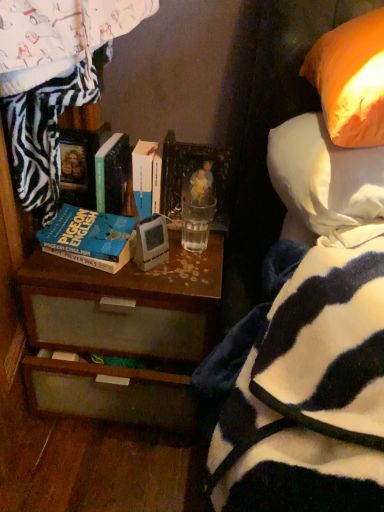
Question: From a real-world perspective, is blue matte book at center left, which appears as the 1th book when viewed from the left, positioned over orange fabric pillow at upper right based on gravity?

Choices:
 (A) yes
 (B) no

Answer: (B)

Question: Are blue matte book at center left, the 3th book viewed from the right, and orange fabric pillow at upper right far apart?

Choices:
 (A) no
 (B) yes

Answer: (A)

Question: Is blue matte book at center left, the 3th book viewed from the right, shorter than orange fabric pillow at upper right?

Choices:
 (A) yes
 (B) no

Answer: (A)

Question: Can you confirm if blue matte book at center left, the 3th book viewed from the right, is positioned to the right of orange fabric pillow at upper right?

Choices:
 (A) no
 (B) yes

Answer: (A)

Question: From the image's perspective, is blue matte book at center left, the 3th book viewed from the right, over orange fabric pillow at upper right?

Choices:
 (A) no
 (B) yes

Answer: (A)

Question: Is blue matte book at center left, which appears as the 1th book when viewed from the left, bigger than orange fabric pillow at upper right?

Choices:
 (A) no
 (B) yes

Answer: (A)

Question: Does brown wood desk at center have a lesser width compared to blue matte book at center left, which appears as the 1th book when viewed from the left?

Choices:
 (A) yes
 (B) no

Answer: (B)

Question: Would you say brown wood desk at center contains blue matte book at center left, which appears as the 1th book when viewed from the left?

Choices:
 (A) yes
 (B) no

Answer: (B)

Question: From the image's perspective, is brown wood desk at center on blue matte book at center left, which appears as the 1th book when viewed from the left?

Choices:
 (A) no
 (B) yes

Answer: (A)

Question: Is brown wood desk at center oriented towards blue matte book at center left, which appears as the 1th book when viewed from the left?

Choices:
 (A) yes
 (B) no

Answer: (B)

Question: Is blue matte book at center left, which appears as the 1th book when viewed from the left, at the back of brown wood desk at center?

Choices:
 (A) yes
 (B) no

Answer: (B)

Question: From the image's perspective, is brown wood desk at center below blue matte book at center left, the 3th book viewed from the right?

Choices:
 (A) yes
 (B) no

Answer: (A)

Question: From a real-world perspective, is hardcover book at center, the second book from the right, positioned over blue matte book at center left, the 3th book viewed from the right, based on gravity?

Choices:
 (A) no
 (B) yes

Answer: (B)